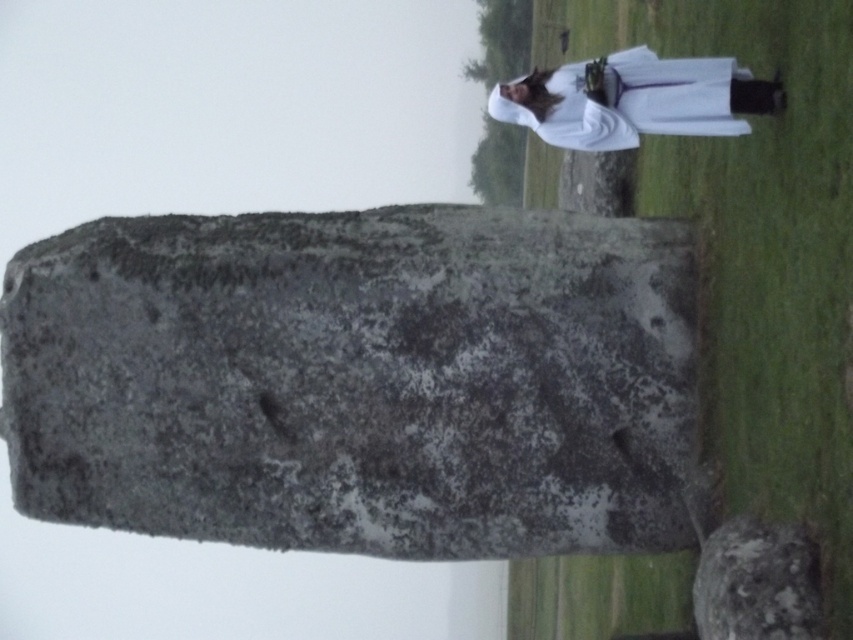
You are an archaeologist examining the gray stone at center and the white cloth at upper right. Which object is bigger in size?

The gray stone at center is larger in size than the white cloth at upper right.

You are standing in front of the large stone monument. There is a point marked at coordinates (357,380). What is located at that point?

The point at coordinates (357,380) indicates the gray stone at center.

You are standing at the center of the monument and want to place a small offering at the exact location of the white cloth at upper right. Given that the monument has a coordinate system where the bottom left corner is the origin point, can you determine the coordinates where you should place your offering?

The white cloth at upper right is located at coordinates point (624, 100), so you should place your offering at those coordinates.